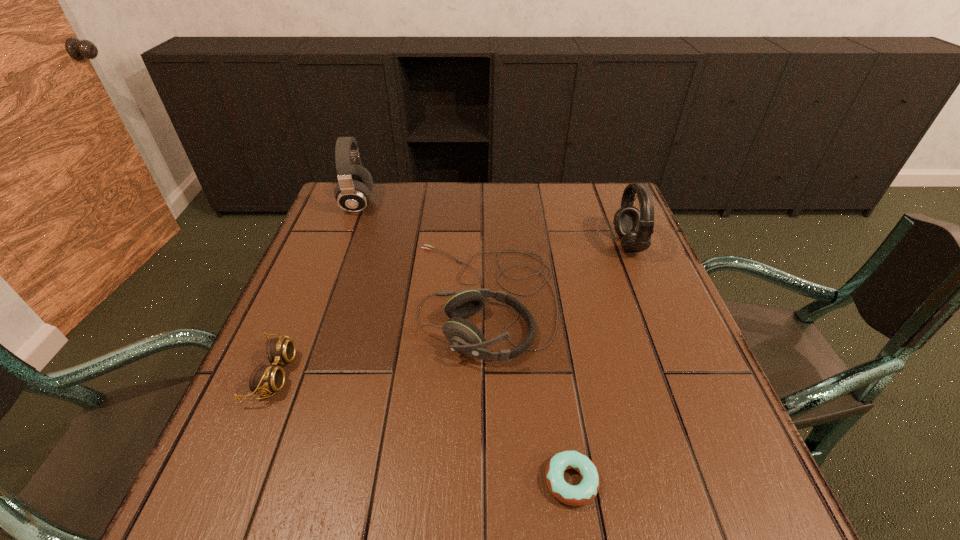
The width and height of the screenshot is (960, 540). Identify the location of vacant area situated 0.250m on the earcups of the rightmost headset. (520, 244).

Where is `vacant space located 0.300m on the earcups of the rightmost headset`? This screenshot has height=540, width=960. vacant space located 0.300m on the earcups of the rightmost headset is located at coordinates (502, 244).

What are the coordinates of `vacant space located on the earcups of the rightmost headset` in the screenshot? It's located at (475, 244).

In order to click on vacant space located 0.150m on the outer surface of the third tallest object in this screenshot , I will do `click(348, 299)`.

Identify the location of free spot located on the outer surface of the third tallest object. (296, 299).

This screenshot has width=960, height=540. Identify the location of free space located on the outer surface of the third tallest object. (322, 299).

Where is `vacant region located 0.190m through the lenses of the second shortest object`? vacant region located 0.190m through the lenses of the second shortest object is located at coordinates (x=389, y=374).

Locate an element on the screen. This screenshot has height=540, width=960. vacant space located on the left of the shortest object is located at coordinates (301, 481).

I want to click on object that is at the near edge, so pyautogui.click(x=574, y=495).

The image size is (960, 540). Find the location of `headset positioned at the left edge`. headset positioned at the left edge is located at coordinates tap(353, 192).